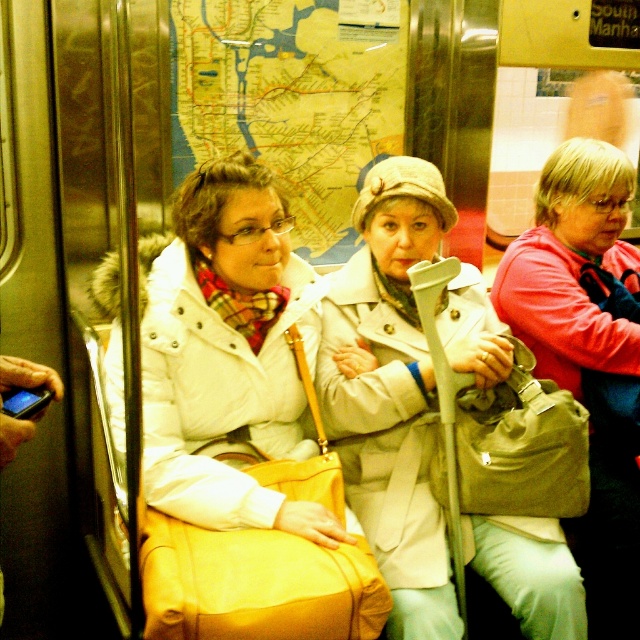
Identify the location of white matte coat at center. (241, 429).

Is white matte coat at center shorter than pink fabric jacket at center?

Yes.

Which is in front, point (289, 572) or point (586, 300)?

Point (289, 572) is in front.

Identify the location of white matte coat at center. This screenshot has width=640, height=640. (241, 429).

Can you confirm if white matte coat at center is positioned to the left of beige fabric coat at center?

Indeed, white matte coat at center is positioned on the left side of beige fabric coat at center.

Is white matte coat at center above beige fabric coat at center?

No.

Find the location of a particular element. white matte coat at center is located at coordinates (241, 429).

Identify the location of white matte coat at center. The height and width of the screenshot is (640, 640). (241, 429).

Who is more distant from viewer, [369,241] or [588,156]?

The point [588,156] is behind.

Which of these two, beige fabric coat at center or pink fabric jacket at center, stands shorter?

Standing shorter between the two is beige fabric coat at center.

What do you see at coordinates (390, 392) in the screenshot? I see `beige fabric coat at center` at bounding box center [390, 392].

Identify the location of beige fabric coat at center. (390, 392).